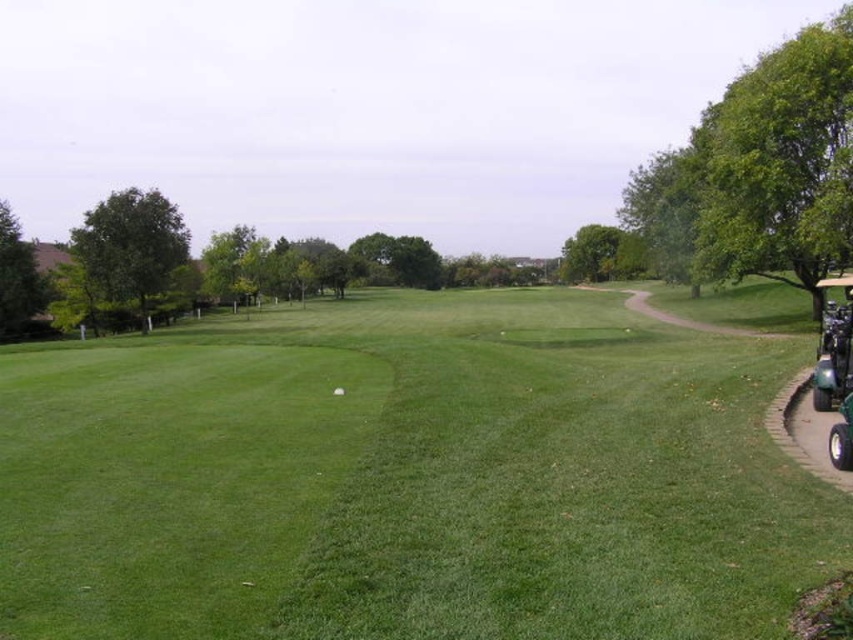
You are a golfer who wants to walk from the green grassy field at center to the green rubber golf cart at right. Which direction should you move to reach the cart?

To reach the green rubber golf cart at right from the green grassy field at center, you should move towards the right since the green rubber golf cart at right is positioned above the green grassy field at center.

You are standing on the green grassy field at center and want to reach the green rubber golf cart at right. Which direction should you walk to get closer to the golf cart?

You should walk towards the right direction because the green rubber golf cart at right is further away from you compared to the green grassy field at center, which is closer to the viewer.

You are standing at the center of the image. Which direction should you walk to reach the green grassy field at center?

The green grassy field at center is already at your current position since you are standing at the center of the image.